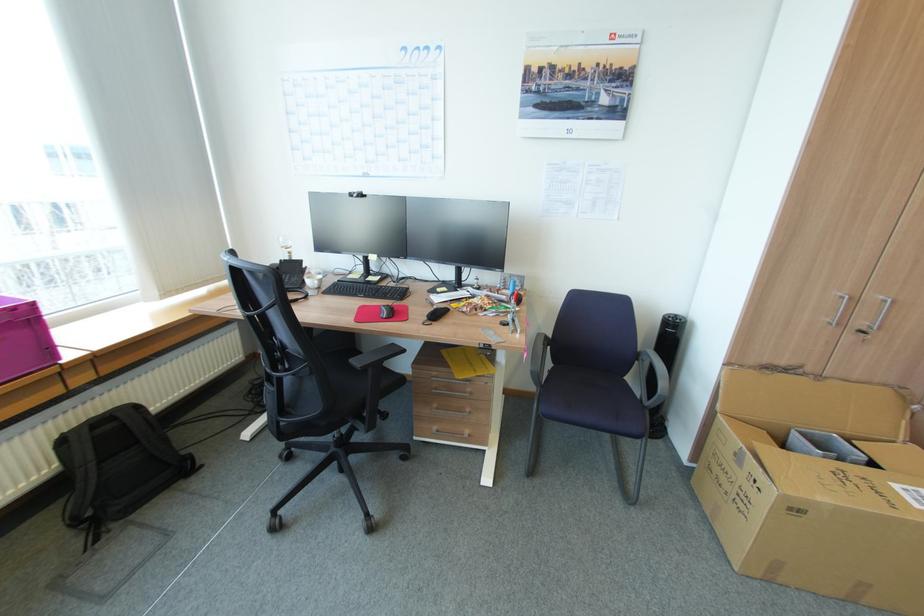
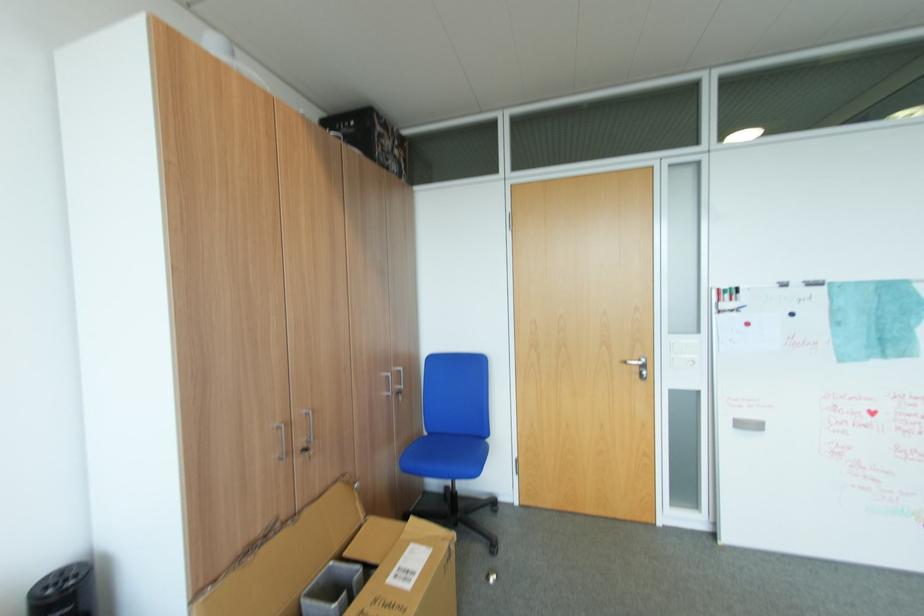
Where in the second image is the point corresponding to (x=807, y=434) from the first image?

(317, 593)